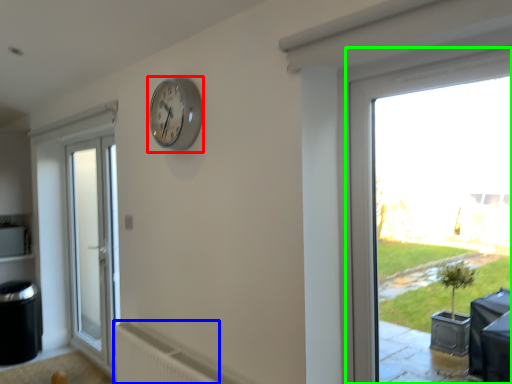
Question: Which object is positioned farthest from clock (highlighted by a red box)? Select from radiator (highlighted by a blue box) and window (highlighted by a green box).

Choices:
 (A) radiator
 (B) window

Answer: (A)